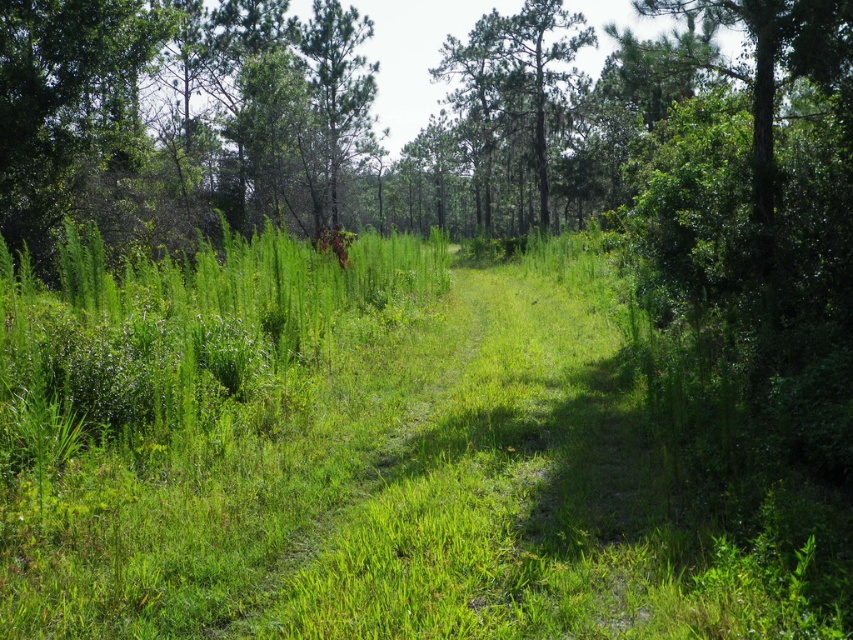
Question: Which point is closer to the camera?

Choices:
 (A) (347, 97)
 (B) (512, 129)

Answer: (A)

Question: Does green leafy tree at center lie behind green rough bark tree at upper center?

Choices:
 (A) no
 (B) yes

Answer: (B)

Question: Which object appears closest to the camera in this image?

Choices:
 (A) green leafy tree at center
 (B) green rough bark tree at upper center

Answer: (B)

Question: Which object appears farthest from the camera in this image?

Choices:
 (A) green rough bark tree at upper center
 (B) green leafy tree at center

Answer: (B)

Question: Is green leafy tree at center positioned at the back of green rough bark tree at upper center?

Choices:
 (A) no
 (B) yes

Answer: (B)

Question: From the image, what is the correct spatial relationship of green leafy tree at center in relation to green rough bark tree at upper center?

Choices:
 (A) above
 (B) below

Answer: (B)